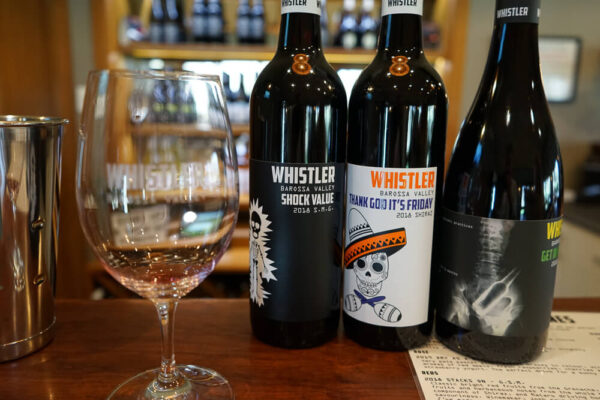
The height and width of the screenshot is (400, 600). What are the coordinates of `metal cup` in the screenshot? It's located at (10, 232).